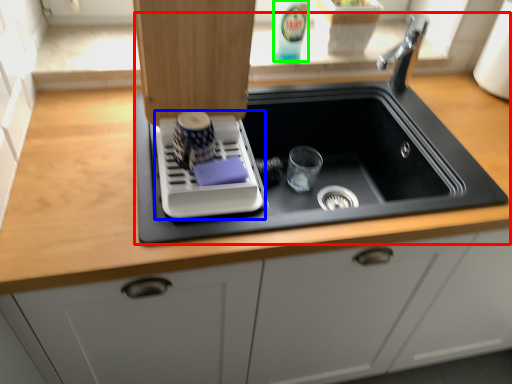
Question: Based on their relative distances, which object is farther from sink (highlighted by a red box)? Choose from appliance (highlighted by a blue box) and beverage (highlighted by a green box).

Choices:
 (A) appliance
 (B) beverage

Answer: (B)